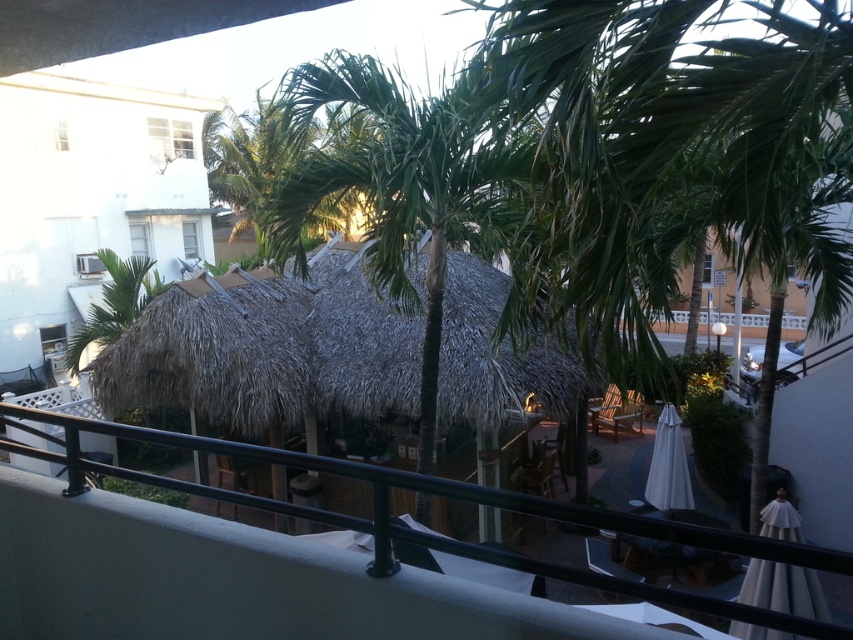
Which is above, thatched straw hut at center or green leafy palm tree at center?

green leafy palm tree at center

Does point (316, 355) lie behind point (437, 156)?

Yes, point (316, 355) is farther from viewer.

The image size is (853, 640). In order to click on thatched straw hut at center in this screenshot , I will do `click(268, 348)`.

At what (x,y) coordinates should I click in order to perform the action: click on thatched straw hut at center. Please return your answer as a coordinate pair (x, y). This screenshot has width=853, height=640. Looking at the image, I should click on (268, 348).

Is point (341, 404) positioned behind point (338, 461)?

Yes, it is behind point (338, 461).

Which is behind, point (341, 348) or point (743, 611)?

Positioned behind is point (341, 348).

This screenshot has height=640, width=853. I want to click on thatched straw hut at center, so click(x=268, y=348).

Who is positioned more to the right, green leafy palm tree at center or black metal/rail at lower center?

green leafy palm tree at center is more to the right.

Can you confirm if green leafy palm tree at center is positioned to the right of black metal/rail at lower center?

Yes, green leafy palm tree at center is to the right of black metal/rail at lower center.

Between point (381, 220) and point (743, 536), which one is positioned in front?

Point (743, 536) is more forward.

In order to click on green leafy palm tree at center in this screenshot , I will do `click(397, 186)`.